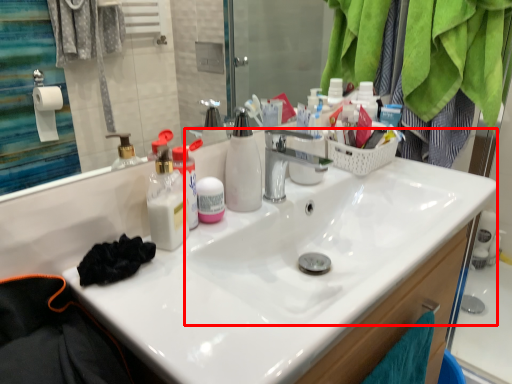
Question: From the image, what is the correct spatial relationship of sink (annotated by the red box) in relation to toiletries?

Choices:
 (A) left
 (B) right

Answer: (B)